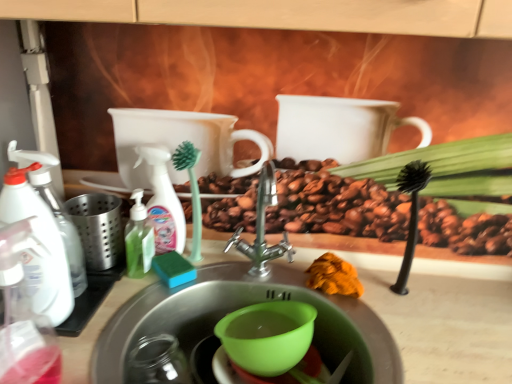
This screenshot has height=384, width=512. Find the location of `vacant area that lies between green translucent pump bottle at left, which is the second cleaning product in left-to-right order, and orange fabric at sink`. vacant area that lies between green translucent pump bottle at left, which is the second cleaning product in left-to-right order, and orange fabric at sink is located at coordinates (249, 276).